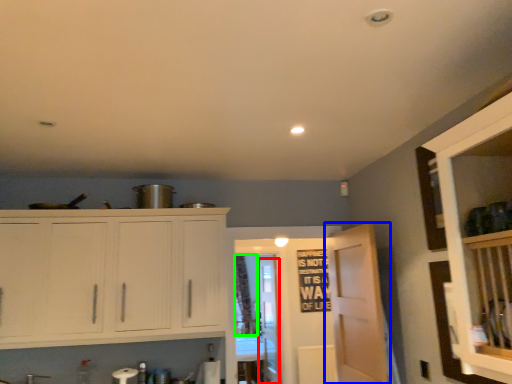
Question: Based on their relative distances, which object is nearer to glass door (highlighted by a red box)? Choose from door (highlighted by a blue box) and curtain (highlighted by a green box).

Choices:
 (A) door
 (B) curtain

Answer: (B)